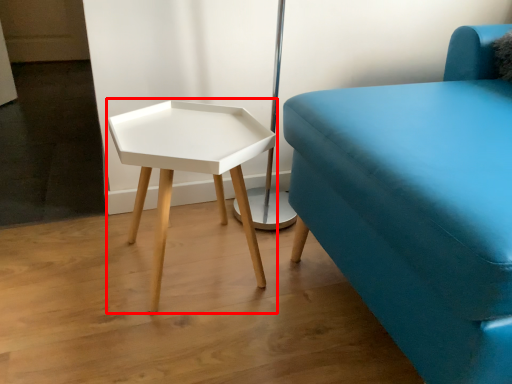
Question: Considering the relative positions of table (annotated by the red box) and studio couch in the image provided, where is table (annotated by the red box) located with respect to the staircase?

Choices:
 (A) left
 (B) right

Answer: (A)